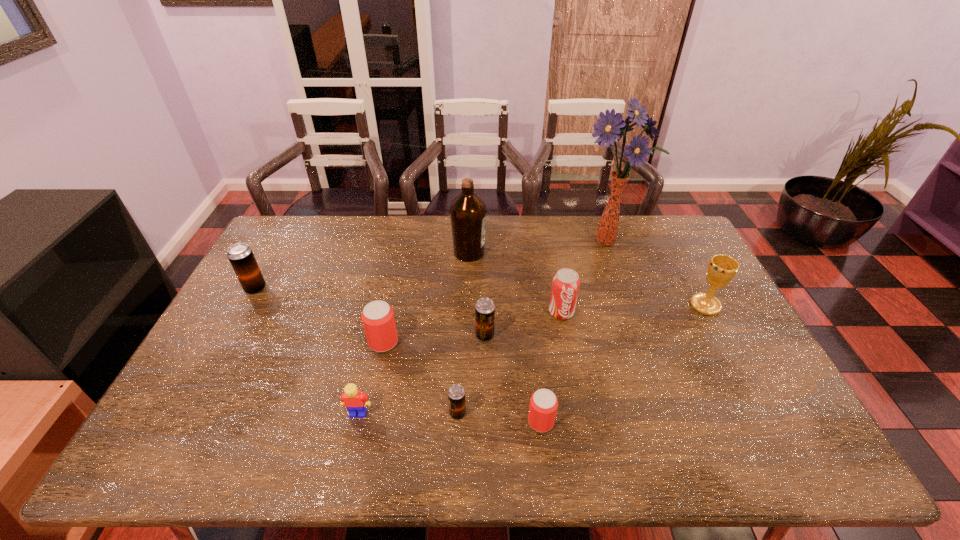
You are a GUI agent. You are given a task and a screenshot of the screen. Output one action in this format:
    pyautogui.click(x=<x>, y=<y>)
    Task: Click on the olive oil that is at the far edge
    The height and width of the screenshot is (540, 960).
    Given the screenshot: What is the action you would take?
    [x=468, y=212]

The width and height of the screenshot is (960, 540). I want to click on object at the near edge, so click(543, 406).

Locate an element on the screen. object present at the left edge is located at coordinates (241, 257).

Image resolution: width=960 pixels, height=540 pixels. Identify the location of object at the right edge. (722, 269).

In the image, there is a desktop. Identify the location of vacant space at the far edge. (444, 226).

Identify the location of vacant space at the near edge of the desktop. (446, 441).

Locate an element on the screen. The width and height of the screenshot is (960, 540). free space at the left edge is located at coordinates (209, 378).

In the image, there is a desktop. Identify the location of blank space at the far left corner. (306, 221).

Locate an element on the screen. free space between the nearest black beer can and the farther red beer can is located at coordinates coord(420,377).

The width and height of the screenshot is (960, 540). What are the coordinates of `unoccupied position between the Lego and the second black beer can from left to right` in the screenshot? It's located at (408, 413).